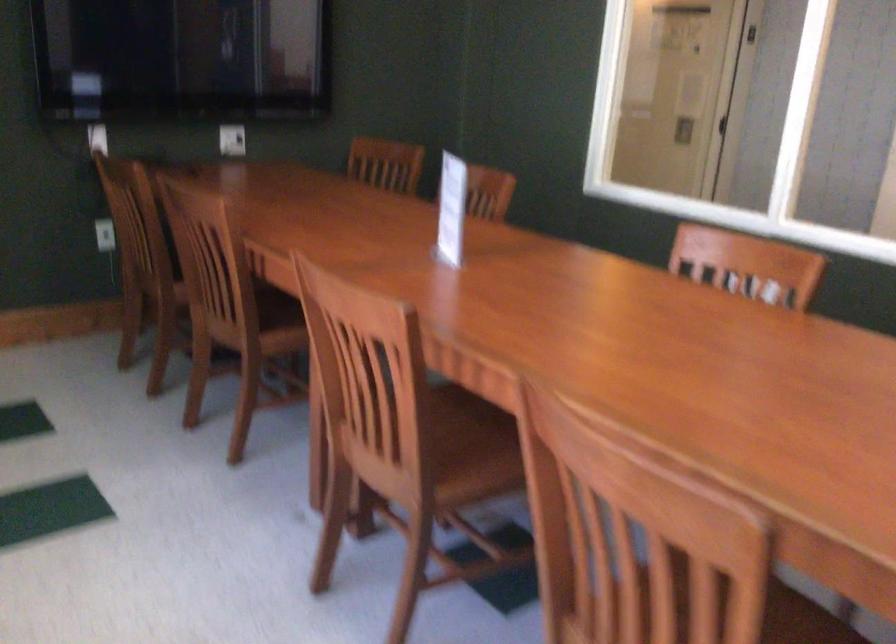
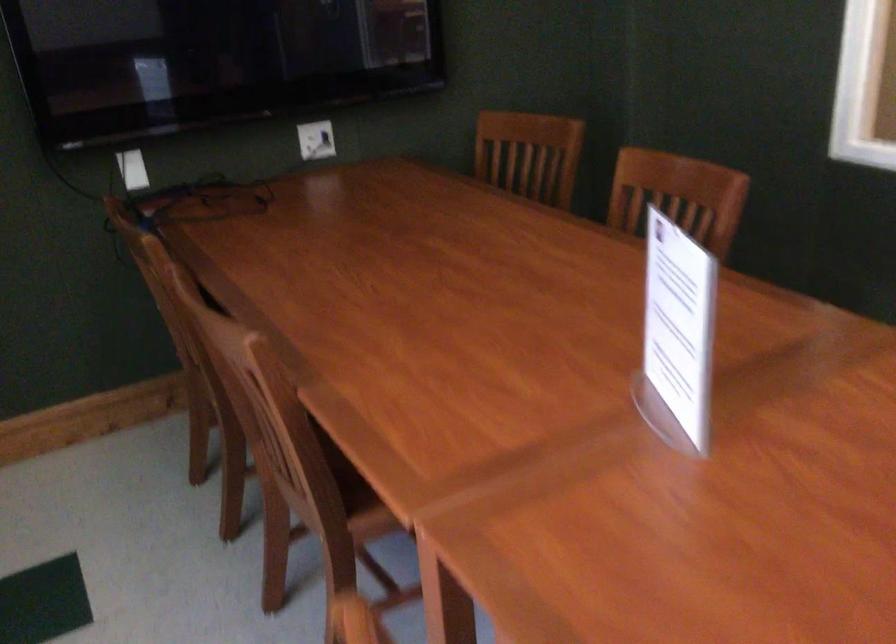
Find the pixel in the second image that matches the point at 246,257 in the first image.

(299, 413)